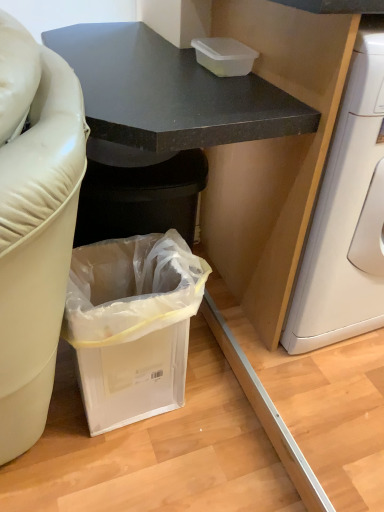
Where is `vacant space to the left of transparent plastic container at upper center`? The image size is (384, 512). vacant space to the left of transparent plastic container at upper center is located at coordinates (161, 64).